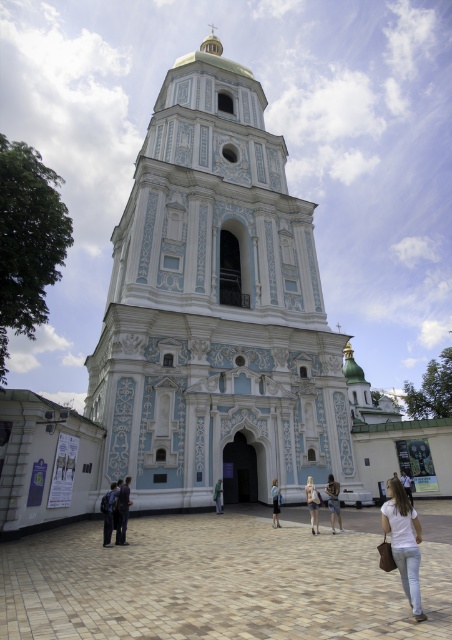
Who is taller, white matte shirt at lower right or green fabric jacket at center?

Standing taller between the two is white matte shirt at lower right.

Can you confirm if white matte shirt at lower right is positioned to the left of green fabric jacket at center?

No, white matte shirt at lower right is not to the left of green fabric jacket at center.

Identify the location of white matte shirt at lower right. This screenshot has height=640, width=452. (404, 541).

Find the location of a particular element. white matte shirt at lower right is located at coordinates (404, 541).

Who is lower down, gold metallic spire at upper center or white cotton shirt at lower center?

Positioned lower is white cotton shirt at lower center.

Can you confirm if gold metallic spire at upper center is shorter than white cotton shirt at lower center?

In fact, gold metallic spire at upper center may be taller than white cotton shirt at lower center.

The height and width of the screenshot is (640, 452). Find the location of `gold metallic spire at upper center`. gold metallic spire at upper center is located at coordinates (211, 44).

Is dark blue jeans at lower left positioned behind white cotton shirt at lower center?

Yes, dark blue jeans at lower left is further from the viewer.

Does dark blue jeans at lower left appear on the left side of white cotton shirt at lower center?

Indeed, dark blue jeans at lower left is positioned on the left side of white cotton shirt at lower center.

Where is `dark blue jeans at lower left`? This screenshot has height=640, width=452. dark blue jeans at lower left is located at coordinates (122, 512).